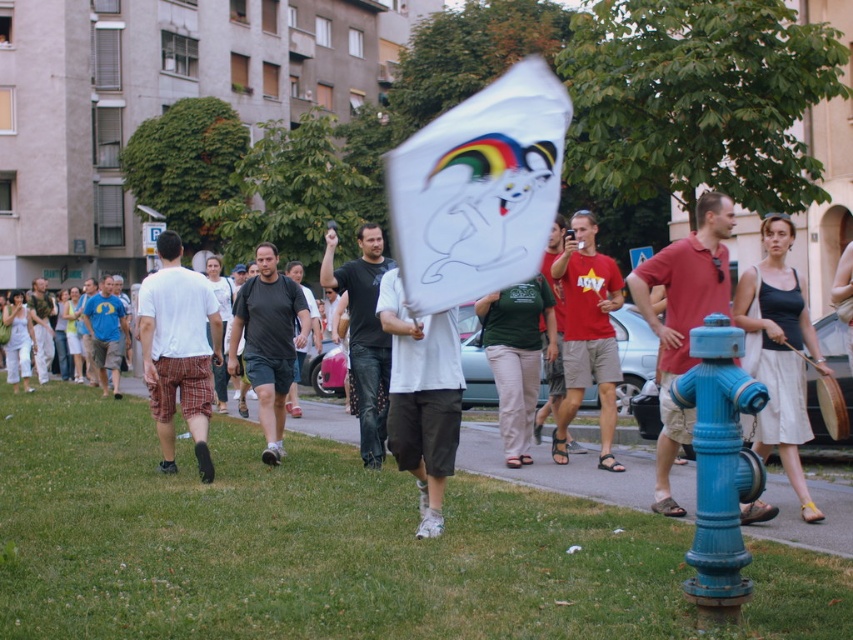
You are standing in the middle of the scene and see a point labeled at coordinates (178, 349). What object is located at that point?

The point at coordinates (178, 349) corresponds to the white cotton t shirt at left.